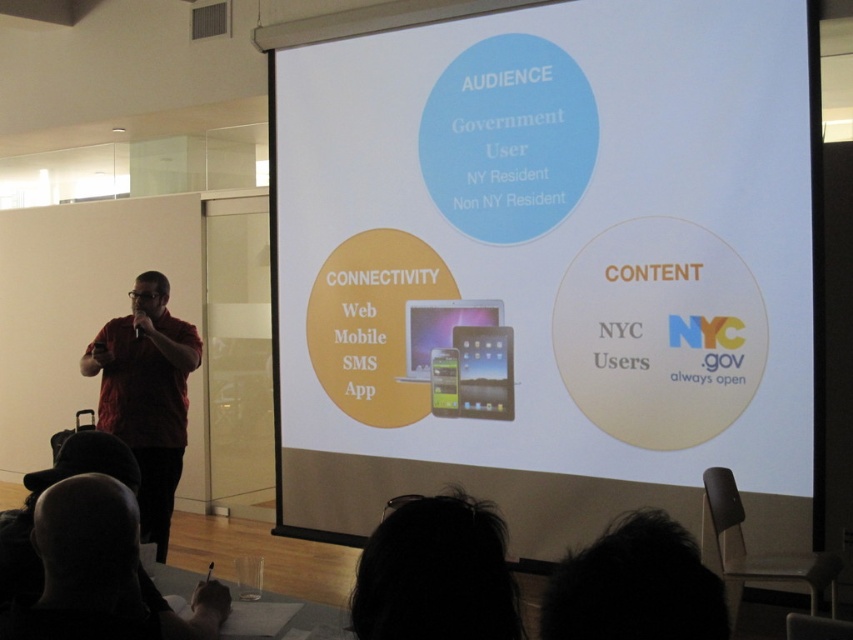
Question: Which point is closer to the camera?

Choices:
 (A) metallic tablet at center
 (B) black hair at lower left
 (C) dark hair at lower center

Answer: (C)

Question: Where is black hair at lower left located in relation to dark fur head at lower center in the image?

Choices:
 (A) below
 (B) above

Answer: (A)

Question: Among these objects, which one is nearest to the camera?

Choices:
 (A) metallic tablet at center
 (B) dark fur head at lower center
 (C) dark hair at lower center

Answer: (B)

Question: Which object appears closest to the camera in this image?

Choices:
 (A) dark fur head at lower center
 (B) dark hair at lower center

Answer: (A)

Question: Is white matte projection screen at center to the right of black hair at lower left from the viewer's perspective?

Choices:
 (A) no
 (B) yes

Answer: (B)

Question: Does dark hair at lower center lie in front of black hair at lower left?

Choices:
 (A) no
 (B) yes

Answer: (B)